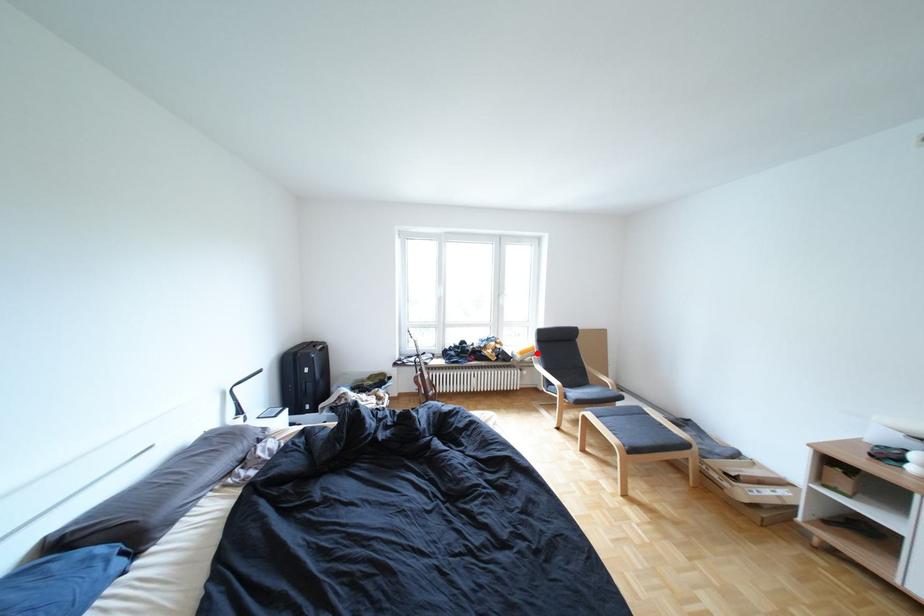
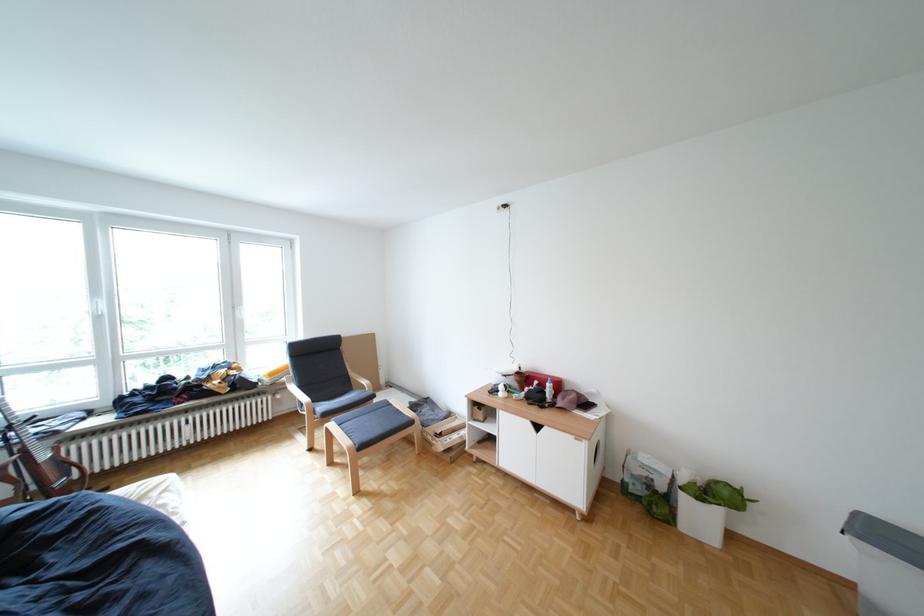
Where in the second image is the point corresponding to the highlighted location from the first image?

(286, 374)